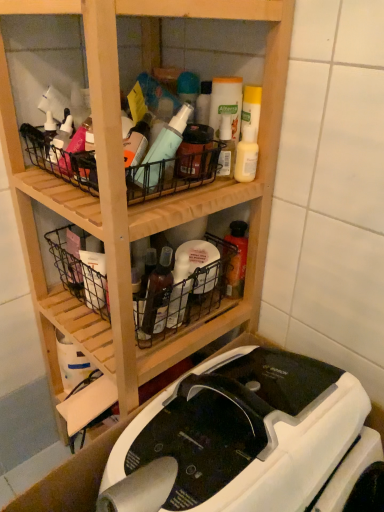
Question: Relative to black wire basket at center, which is the second basket in top-to-bottom order, is white plastic sewing machine at lower center in front or behind?

Choices:
 (A) behind
 (B) front

Answer: (B)

Question: Is white plastic sewing machine at lower center to the left or to the right of black wire basket at center, the 1th basket positioned from the bottom, in the image?

Choices:
 (A) right
 (B) left

Answer: (A)

Question: Estimate the real-world distances between objects in this image. Which object is closer to the white plastic sewing machine at lower center?

Choices:
 (A) black wire basket at upper center, the second basket from the bottom
 (B) black wire basket at center, the 1th basket positioned from the bottom
 (C) wooden shelf at center

Answer: (B)

Question: Based on their relative distances, which object is nearer to the wooden shelf at center?

Choices:
 (A) black wire basket at center, the 1th basket positioned from the bottom
 (B) black wire basket at upper center, marked as the 1th basket in a top-to-bottom arrangement
 (C) white plastic sewing machine at lower center

Answer: (A)